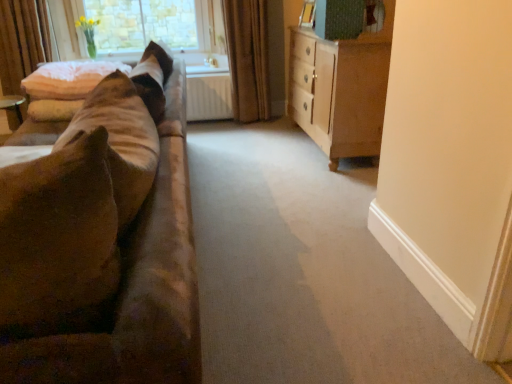
I want to click on vacant area that lies between suede-like brown couch at left and light brown wood dresser at right, so click(283, 213).